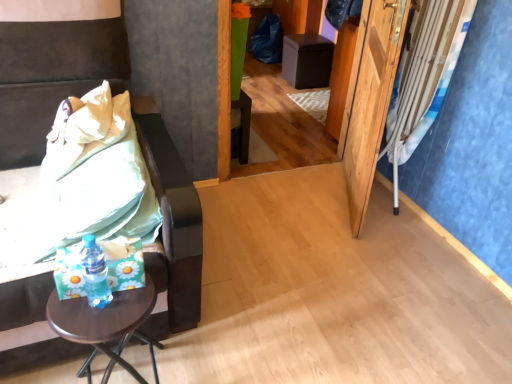
Question: Considering the positions of point (59, 193) and point (355, 185), is point (59, 193) closer or farther from the camera than point (355, 185)?

Choices:
 (A) farther
 (B) closer

Answer: (B)

Question: Based on their sizes in the image, would you say green fabric bedsheet at left is bigger or smaller than wooden screen door at right?

Choices:
 (A) big
 (B) small

Answer: (A)

Question: Which object is the farthest from the brown wooden side table at left, arranged as the 2th furniture when viewed from the top?

Choices:
 (A) wooden screen door at right
 (B) green fabric bedsheet at left
 (C) translucent plastic bottle at lower left
 (D) blue fabric curtain at right
 (E) brown wooden table at lower left

Answer: (D)

Question: Which object is the farthest from the wooden screen door at right?

Choices:
 (A) blue fabric curtain at right
 (B) translucent plastic bottle at lower left
 (C) brown wooden table at lower left
 (D) black leather ottoman at center, acting as the 2th furniture starting from the bottom
 (E) green fabric bedsheet at left

Answer: (B)